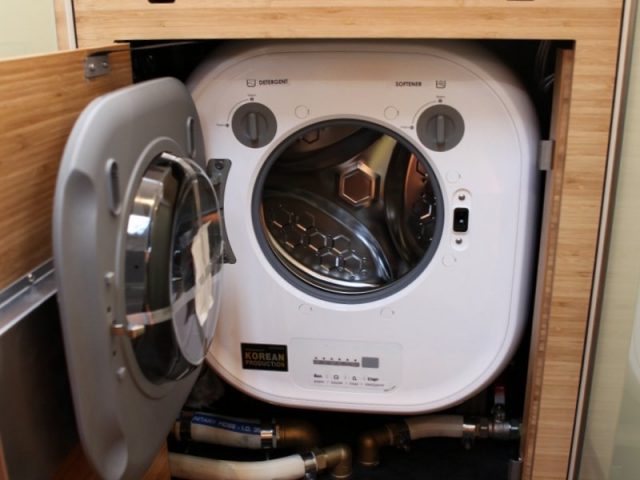
Where is `washing machine black label that reads "korean"`? The image size is (640, 480). washing machine black label that reads "korean" is located at coordinates (274, 355).